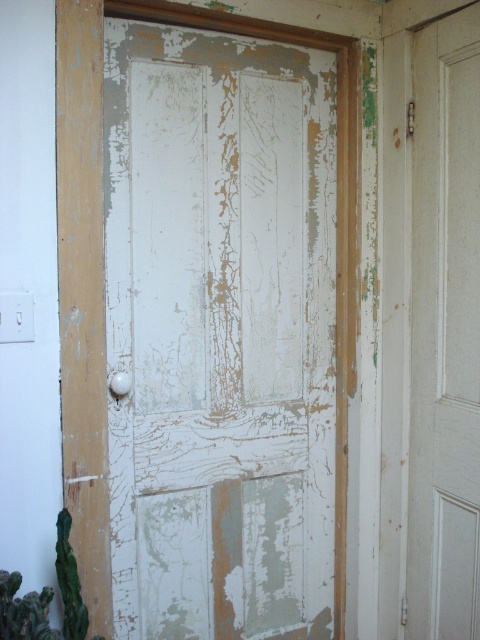
Question: Is white peeling paint at center closer to camera compared to white matte door at center?

Choices:
 (A) no
 (B) yes

Answer: (B)

Question: Does white peeling paint at center appear on the right side of white matte door at center?

Choices:
 (A) yes
 (B) no

Answer: (B)

Question: Which point is closer to the camera?

Choices:
 (A) white peeling paint at center
 (B) white matte door at center

Answer: (A)

Question: Among these points, which one is farthest from the camera?

Choices:
 (A) (346, 483)
 (B) (451, 243)

Answer: (A)

Question: Which object is farther from the camera taking this photo?

Choices:
 (A) white peeling paint at center
 (B) white matte door at center

Answer: (B)

Question: Is white peeling paint at center to the right of white matte door at center from the viewer's perspective?

Choices:
 (A) no
 (B) yes

Answer: (A)